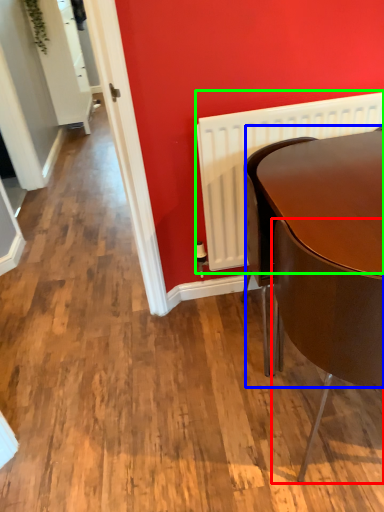
Question: Which object is the farthest from chair (highlighted by a red box)? Choose among these: round table (highlighted by a blue box) or radiator (highlighted by a green box).

Choices:
 (A) round table
 (B) radiator

Answer: (B)